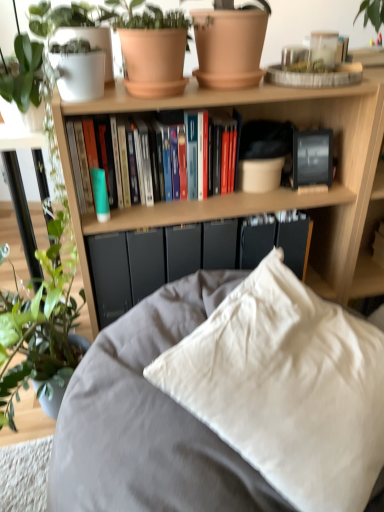
What is the approximate height of wooden bookcase at upper center?

The height of wooden bookcase at upper center is 37.48 inches.

The image size is (384, 512). Describe the element at coordinates (268, 192) in the screenshot. I see `wooden bookcase at upper center` at that location.

The width and height of the screenshot is (384, 512). What do you see at coordinates (209, 161) in the screenshot? I see `hardcover books at center` at bounding box center [209, 161].

Image resolution: width=384 pixels, height=512 pixels. What are the coordinates of `matte black paperback book at center, marked as the second paperback book in a right-to-left arrangement` in the screenshot? It's located at (145, 261).

Find the location of a particular element. wooden bookcase at upper center is located at coordinates (268, 192).

Can you confirm if white cotton pillow at center is taller than wooden bookcase at upper center?

No.

Which is behind, point (227, 329) or point (119, 102)?

The point (119, 102) is farther from the camera.

Based on their positions, is white cotton pillow at center located to the left or right of wooden bookcase at upper center?

white cotton pillow at center is to the left of wooden bookcase at upper center.

Does white cotton pillow at center have a smaller size compared to wooden bookcase at upper center?

Yes, white cotton pillow at center is smaller than wooden bookcase at upper center.

Between wooden bookcase at upper center and matte black paperback book at center, marked as the second paperback book in a right-to-left arrangement, which one has less height?

With less height is matte black paperback book at center, marked as the second paperback book in a right-to-left arrangement.

Looking at this image, does wooden bookcase at upper center appear on the left side of matte black paperback book at center, marked as the second paperback book in a right-to-left arrangement?

No, wooden bookcase at upper center is not to the left of matte black paperback book at center, marked as the second paperback book in a right-to-left arrangement.

Considering the relative sizes of wooden bookcase at upper center and matte black paperback book at center, which appears as the 1th paperback book when viewed from the left, in the image provided, is wooden bookcase at upper center smaller than matte black paperback book at center, which appears as the 1th paperback book when viewed from the left,?

Incorrect, wooden bookcase at upper center is not smaller in size than matte black paperback book at center, which appears as the 1th paperback book when viewed from the left.

Between hardcover books at center and matte black paperback book at center, which appears as the 1th paperback book when viewed from the left, which one is positioned behind?

matte black paperback book at center, which appears as the 1th paperback book when viewed from the left, is more distant.

Is point (142, 156) closer or farther from the camera than point (138, 245)?

Clearly, point (142, 156) is closer to the camera than point (138, 245).

Considering the relative positions of hardcover books at center and matte black paperback book at center, marked as the second paperback book in a right-to-left arrangement, in the image provided, is hardcover books at center to the right of matte black paperback book at center, marked as the second paperback book in a right-to-left arrangement, from the viewer's perspective?

Yes, hardcover books at center is to the right of matte black paperback book at center, marked as the second paperback book in a right-to-left arrangement.

Considering the relative sizes of hardcover books at center and matte black paperback book at center, marked as the second paperback book in a right-to-left arrangement, in the image provided, is hardcover books at center wider than matte black paperback book at center, marked as the second paperback book in a right-to-left arrangement,?

Yes.

Is green glossy plant at left thinner than matte black paperback book at center, marked as the second paperback book in a right-to-left arrangement?

Incorrect, the width of green glossy plant at left is not less than that of matte black paperback book at center, marked as the second paperback book in a right-to-left arrangement.

Which object is positioned more to the left, green glossy plant at left or matte black paperback book at center, marked as the second paperback book in a right-to-left arrangement?

green glossy plant at left is more to the left.

Is green glossy plant at left oriented away from matte black paperback book at center, marked as the second paperback book in a right-to-left arrangement?

green glossy plant at left is not turned away from matte black paperback book at center, marked as the second paperback book in a right-to-left arrangement.

Is terracotta clay pot at upper center, the 2th flowerpot viewed from the right, positioned behind terracotta clay pot at upper center, which is the 1th flowerpot in right-to-left order?

No, terracotta clay pot at upper center, the 2th flowerpot viewed from the right, is closer to the camera.

Is terracotta clay pot at upper center, the 1th flowerpot positioned from the left, facing away from terracotta clay pot at upper center, which is the 1th flowerpot in right-to-left order?

terracotta clay pot at upper center, the 1th flowerpot positioned from the left, does not have its back to terracotta clay pot at upper center, which is the 1th flowerpot in right-to-left order.

What's the angular difference between terracotta clay pot at upper center, the 1th flowerpot positioned from the left, and terracotta clay pot at upper center, the 2th flowerpot from the left,'s facing directions?

The facing directions of terracotta clay pot at upper center, the 1th flowerpot positioned from the left, and terracotta clay pot at upper center, the 2th flowerpot from the left, are 0.00125 degrees apart.

Consider the image. From a real-world perspective, who is located lower, terracotta clay pot at upper center, the 1th flowerpot positioned from the left, or terracotta clay pot at upper center, which is the 1th flowerpot in right-to-left order?

terracotta clay pot at upper center, the 1th flowerpot positioned from the left.

Identify the location of houseplant on the left of hardcover books at center. This screenshot has width=384, height=512. (23, 84).

From a real-world perspective, who is located higher, hardcover books at center or green glossy plant at left?

From a 3D spatial view, green glossy plant at left is above.

Is point (215, 155) positioned before point (16, 54)?

No, (215, 155) is behind (16, 54).

Which of these two, hardcover books at center or green glossy plant at left, is smaller?

Smaller between the two is green glossy plant at left.

Would you say wooden bookcase at upper center is to the left or to the right of terracotta clay pot at upper center, the 2th flowerpot viewed from the right, in the picture?

Based on their positions, wooden bookcase at upper center is located to the right of terracotta clay pot at upper center, the 2th flowerpot viewed from the right.

Is wooden bookcase at upper center positioned with its back to terracotta clay pot at upper center, the 1th flowerpot positioned from the left?

wooden bookcase at upper center does not have its back to terracotta clay pot at upper center, the 1th flowerpot positioned from the left.

Which point is more distant from viewer, (x=225, y=200) or (x=174, y=38)?

The point (x=225, y=200) is behind.

Based on the photo, from their relative heights in the image, would you say wooden bookcase at upper center is taller or shorter than terracotta clay pot at upper center, the 2th flowerpot viewed from the right?

Clearly, wooden bookcase at upper center is taller compared to terracotta clay pot at upper center, the 2th flowerpot viewed from the right.

You are a GUI agent. You are given a task and a screenshot of the screen. Output one action in this format:
    pyautogui.click(x=<x>, y=<y>)
    Task: Click on the pillow that is above the wooden bookcase at upper center (from a real-world perspective)
    This screenshot has width=384, height=512.
    Given the screenshot: What is the action you would take?
    pyautogui.click(x=287, y=388)

In order to click on bookcase that appears on the right of matte black paperback book at center, which appears as the 1th paperback book when viewed from the left in this screenshot , I will do `click(268, 192)`.

Considering their positions, is matte black paperback book at center, which appears as the 1th paperback book when viewed from the left, positioned closer to terracotta clay pot at upper center, the 1th flowerpot positioned from the left, than terracotta clay pot at upper center, which is the 1th flowerpot in right-to-left order?

terracotta clay pot at upper center, which is the 1th flowerpot in right-to-left order, lies closer to terracotta clay pot at upper center, the 1th flowerpot positioned from the left, than the other object.

Which object lies further to the anchor point terracotta clay pot at upper center, the 2th flowerpot from the left, terracotta clay pot at upper center, the 1th flowerpot positioned from the left, or hardcover books at center?

hardcover books at center is positioned further to the anchor terracotta clay pot at upper center, the 2th flowerpot from the left.

Based on their spatial positions, is matte black paperback book at center, acting as the second paperback book starting from the left, or wooden bookcase at upper center further from hardcover books at center?

matte black paperback book at center, acting as the second paperback book starting from the left, lies further to hardcover books at center than the other object.

From the image, which object appears to be nearer to white cotton pillow at center, matte black paperback book at center, which appears as the 1th paperback book when viewed from the left, or wooden bookcase at upper center?

wooden bookcase at upper center is closer to white cotton pillow at center.

Considering their positions, is green glossy plant at left positioned closer to terracotta clay pot at upper center, the 1th flowerpot positioned from the left, than hardcover books at center?

hardcover books at center.

Considering their positions, is terracotta clay pot at upper center, which is the 1th flowerpot in right-to-left order, positioned closer to hardcover books at center than white cotton pillow at center?

terracotta clay pot at upper center, which is the 1th flowerpot in right-to-left order, is positioned closer to the anchor hardcover books at center.

Based on their spatial positions, is wooden bookcase at upper center or hardcover books at center further from white cotton pillow at center?

hardcover books at center is positioned further to the anchor white cotton pillow at center.

Which object lies nearer to the anchor point white cotton pillow at center, terracotta clay pot at upper center, the 1th flowerpot positioned from the left, or terracotta clay pot at upper center, which is the 1th flowerpot in right-to-left order?

terracotta clay pot at upper center, the 1th flowerpot positioned from the left, is positioned closer to the anchor white cotton pillow at center.

This screenshot has height=512, width=384. What are the coordinates of `bookcase between terracotta clay pot at upper center, the 2th flowerpot from the left, and matte black paperback book at center, the 1th paperback book viewed from the right, in the vertical direction` in the screenshot? It's located at (268, 192).

Find the location of a particular element. The height and width of the screenshot is (512, 384). flowerpot between terracotta clay pot at upper center, the 2th flowerpot from the left, and hardcover books at center, in the vertical direction is located at coordinates (153, 61).

You are a GUI agent. You are given a task and a screenshot of the screen. Output one action in this format:
    pyautogui.click(x=<x>, y=<y>)
    Task: Click on the bookcase between white cotton pillow at center and hardcover books at center along the z-axis
    The height and width of the screenshot is (512, 384).
    Given the screenshot: What is the action you would take?
    pyautogui.click(x=268, y=192)

Find the location of a particular element. This screenshot has height=512, width=384. houseplant between terracotta clay pot at upper center, the 2th flowerpot from the left, and white cotton pillow at center vertically is located at coordinates (23, 84).